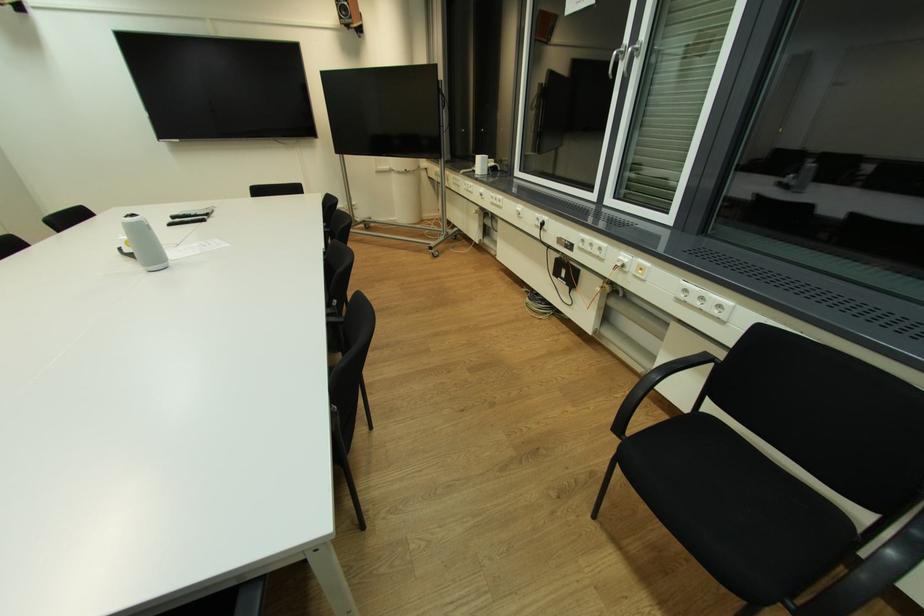
You are a GUI agent. You are given a task and a screenshot of the screen. Output one action in this format:
    pyautogui.click(x=<x>, y=<y>)
    Task: Click on the black chair armrest
    The height and width of the screenshot is (616, 924).
    Given the screenshot: What is the action you would take?
    (682, 381)